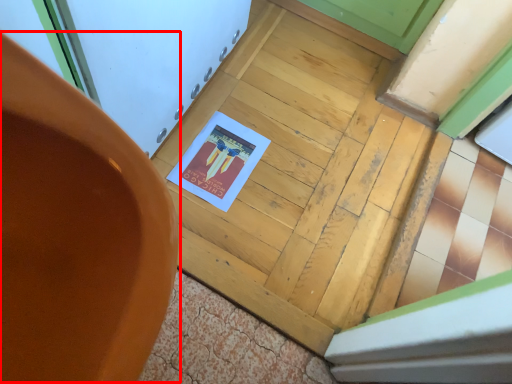
Question: From the image's perspective, where is chair (annotated by the red box) located in relation to door in the image?

Choices:
 (A) below
 (B) above

Answer: (A)